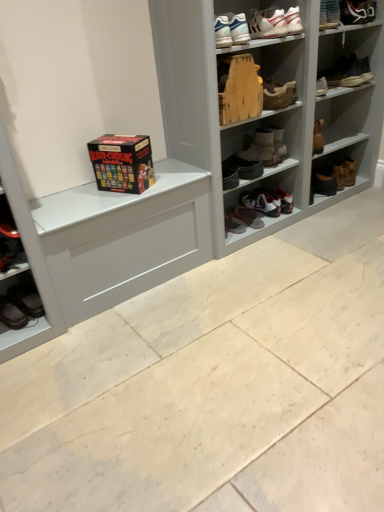
At what (x,y) coordinates should I click in order to perform the action: click on vacant area that is in front of white painted wood shelf at upper center. Please return your answer as a coordinate pair (x, y). Looking at the image, I should click on (223, 347).